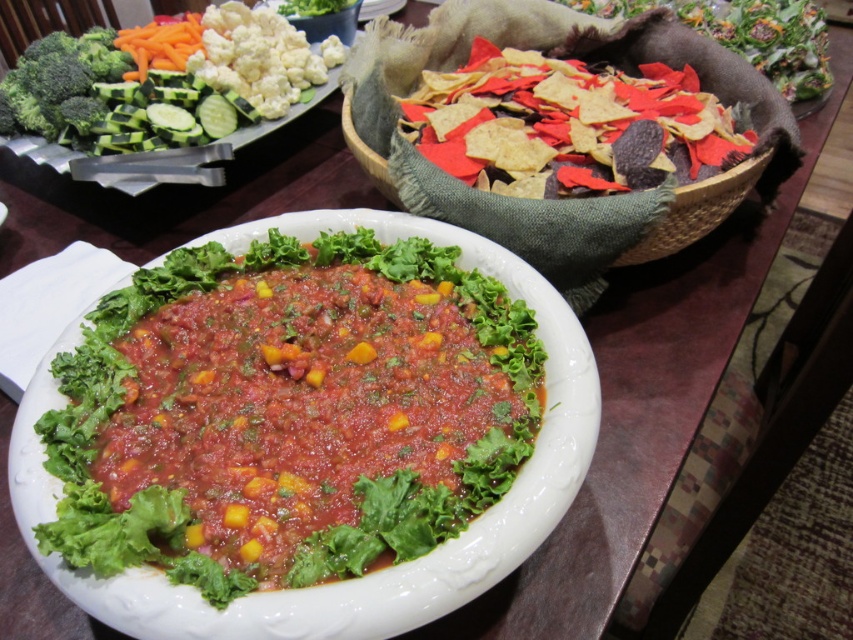
You are arranging a buffet table and want to place a decorative centerpiece between the green leafy vegetable at upper left and the green matte broccoli at upper left. Given that the centerpiece is 9 inches wide, will it fit in the space between them?

The distance between the green leafy vegetable at upper left and the green matte broccoli at upper left is 8.84 inches. Since the centerpiece is 9 inches wide, it will not fit as the space is slightly narrower than the centerpiece.

You are standing at the buffet table and want to reach the point at coordinates point (x=270, y=93). If your arm can extend 1 meter, can you reach it?

The point (x=270, y=93) is 1.25 meters from the camera, so your arm can only extend 1 meter. Therefore, you cannot reach it.